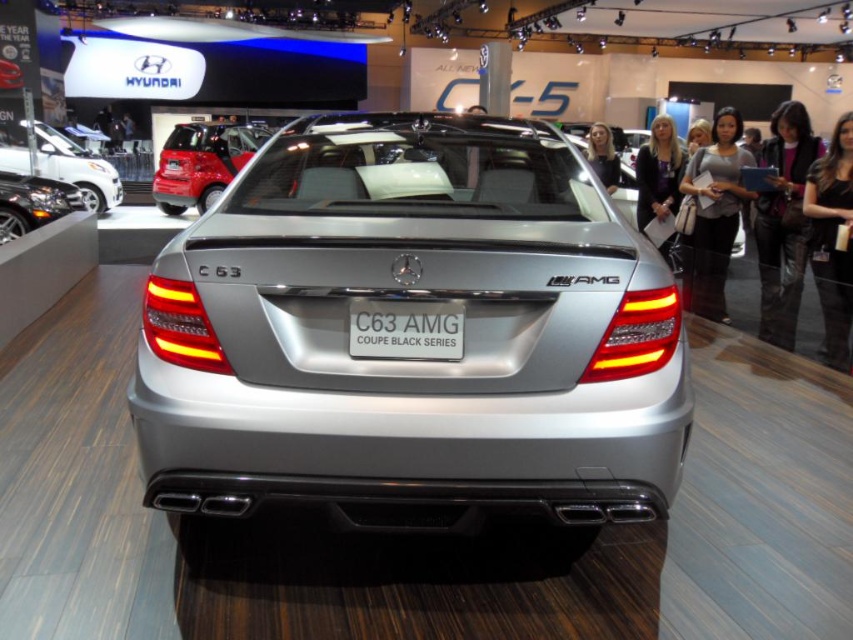
Question: Which object appears farthest from the camera in this image?

Choices:
 (A) silver metallic hatchback at center
 (B) satin silver car at center
 (C) silver metallic car at right
 (D) polished chrome engine at lower left

Answer: (A)

Question: Considering the relative positions of silver metallic car at right and polished chrome engine at lower left in the image provided, where is silver metallic car at right located with respect to polished chrome engine at lower left?

Choices:
 (A) above
 (B) below

Answer: (B)

Question: Which point appears closest to the camera in this image?

Choices:
 (A) (50, 179)
 (B) (291, 458)
 (C) (234, 125)
 (D) (717, 125)

Answer: (B)

Question: From the image, what is the correct spatial relationship of silver metallic car at right in relation to silver metallic hatchback at center?

Choices:
 (A) right
 (B) left

Answer: (A)

Question: Can you confirm if satin silver car at center is bigger than black metallic license plate at center?

Choices:
 (A) yes
 (B) no

Answer: (A)

Question: Which point is closer to the camera taking this photo?

Choices:
 (A) (4, 221)
 (B) (703, 316)
 (C) (231, 141)

Answer: (B)